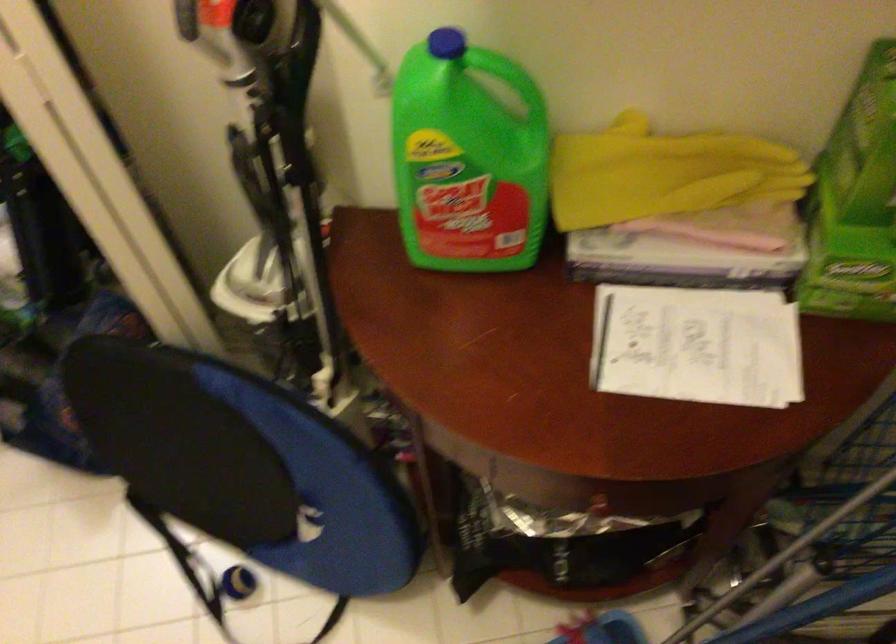
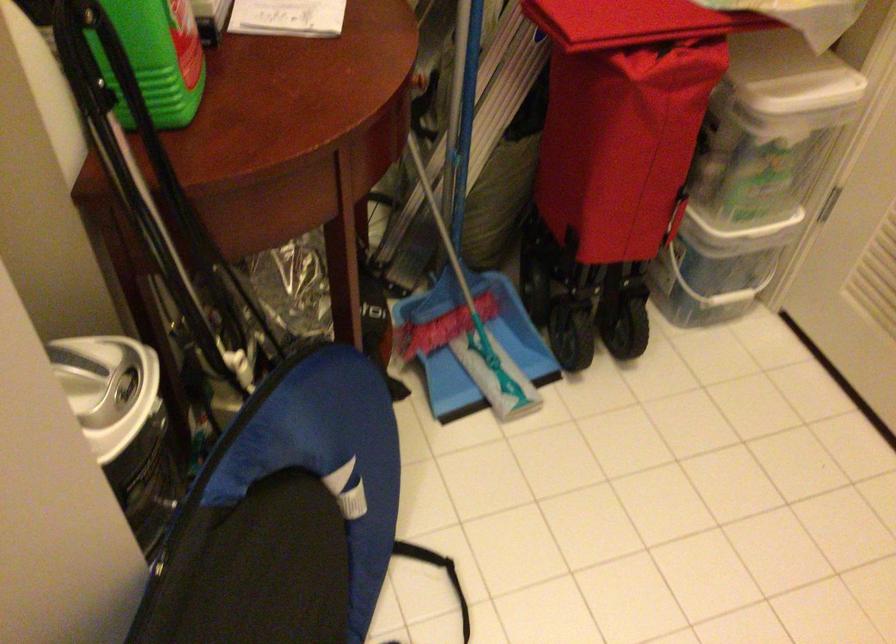
Find the pixel in the second image that matches (x=207, y=440) in the first image.

(271, 569)